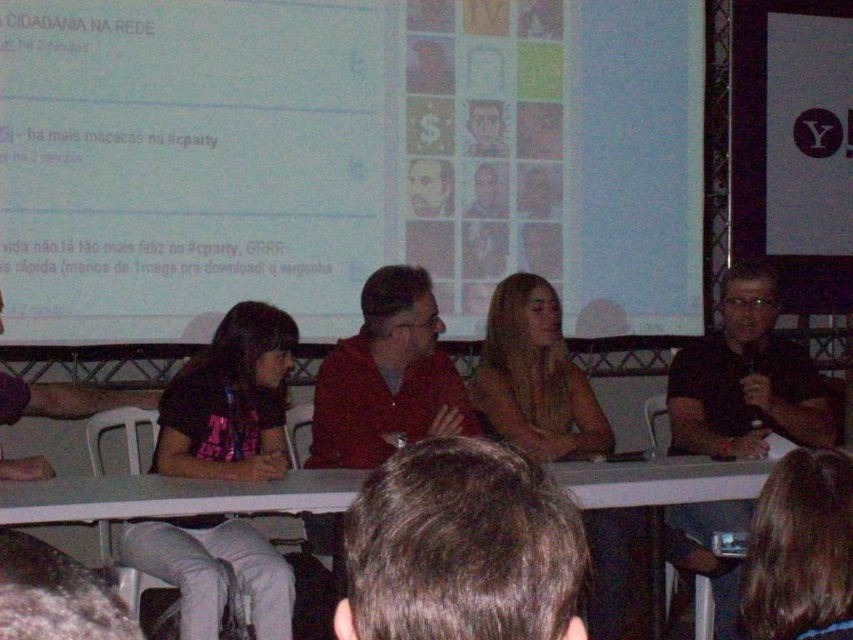
Question: Can you confirm if black matte shirt at right is positioned above blonde hair at center?

Choices:
 (A) yes
 (B) no

Answer: (B)

Question: Which point is farther to the camera?

Choices:
 (A) (619, 556)
 (B) (804, 419)

Answer: (A)

Question: Is white matte projection screen at upper center above black matte shirt at right?

Choices:
 (A) no
 (B) yes

Answer: (B)

Question: Which point appears farthest from the camera in this image?

Choices:
 (A) (764, 349)
 (B) (100, 106)
 (C) (566, 518)

Answer: (A)

Question: Does black matte shirt at right come behind white plastic table at center?

Choices:
 (A) yes
 (B) no

Answer: (A)

Question: Based on their relative distances, which object is farther from the blonde hair at center?

Choices:
 (A) dark brown hair at center
 (B) white plastic table at center

Answer: (A)